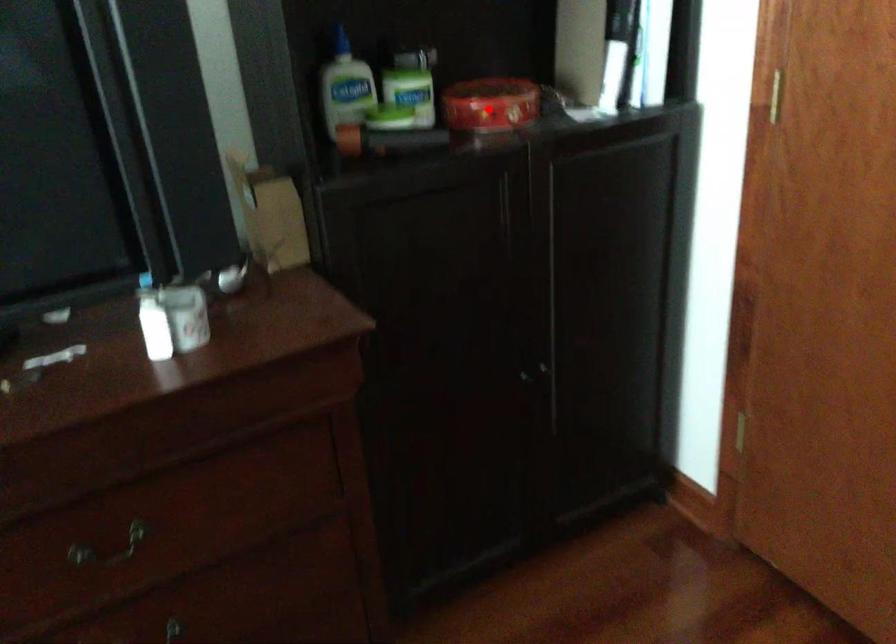
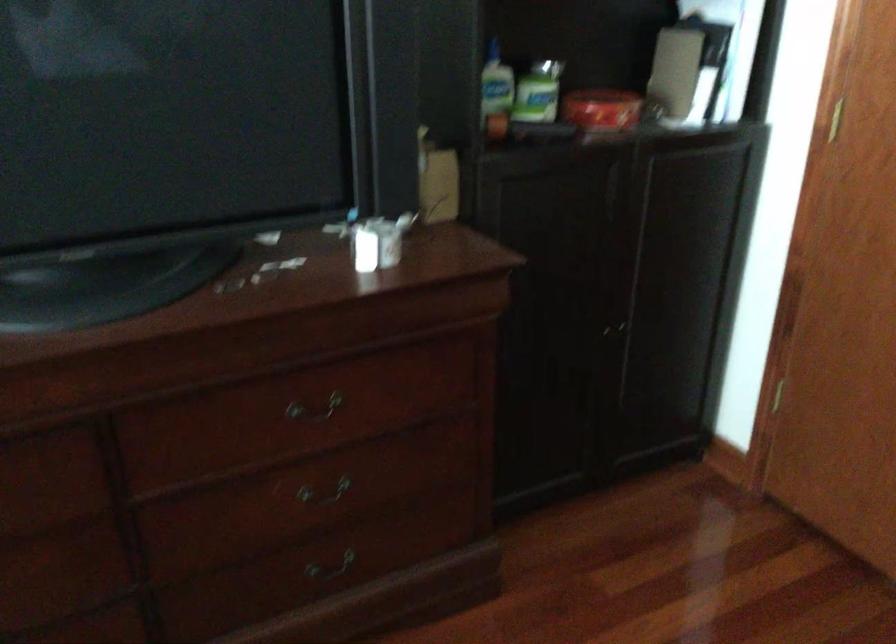
Question: I am providing you with two images of the same scene from different viewpoints. Image1 has a red point marked. In image2, the corresponding 3D location appears at what relative position? Reply with the corresponding letter.

Choices:
 (A) Closer
 (B) Farther

Answer: (B)